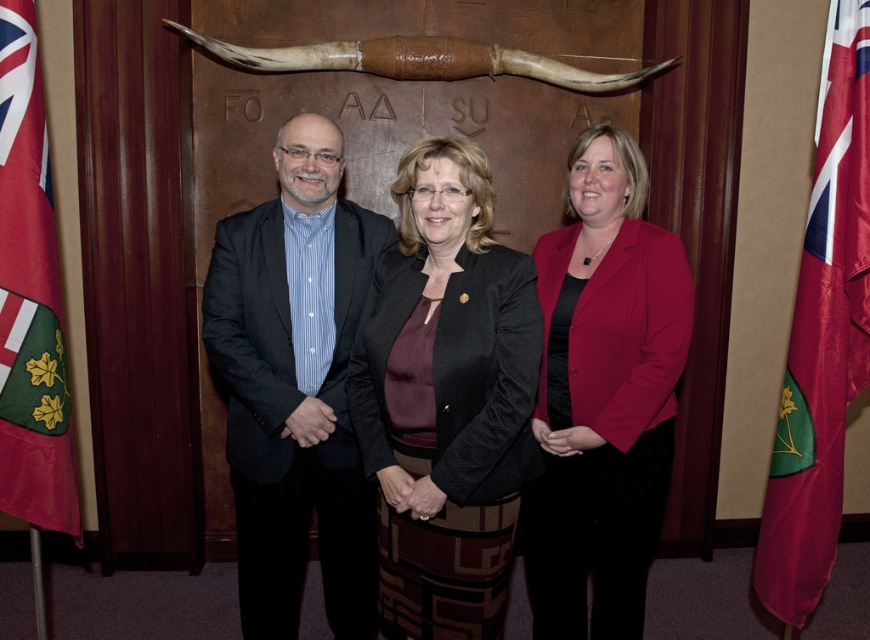
Can you confirm if matte red blazer at center is wider than red fabric flag at left?

Correct, the width of matte red blazer at center exceeds that of red fabric flag at left.

Is point (633, 420) more distant than point (15, 371)?

No.

Is point (668, 397) positioned before point (44, 333)?

That is False.

Where is `matte red blazer at center`? The image size is (870, 640). matte red blazer at center is located at coordinates (603, 396).

Which of these two, black textured blazer at center or red fabric flag at left, stands shorter?

With less height is black textured blazer at center.

Is black textured blazer at center thinner than red fabric flag at left?

In fact, black textured blazer at center might be wider than red fabric flag at left.

I want to click on black textured blazer at center, so click(446, 397).

Between matte red blazer at center and red satin flag at right, which one appears on the left side from the viewer's perspective?

Positioned to the left is matte red blazer at center.

Is point (619, 624) farther from camera compared to point (850, 99)?

Yes, point (619, 624) is farther from viewer.

The image size is (870, 640). I want to click on matte red blazer at center, so click(x=603, y=396).